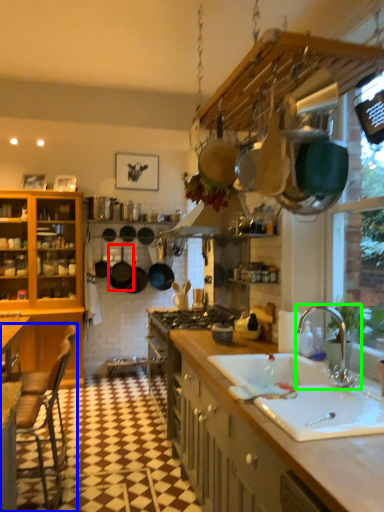
Question: Considering the real-world distances, which object is farthest from frying pan (highlighted by a red box)? chair (highlighted by a blue box) or tap (highlighted by a green box)?

Choices:
 (A) chair
 (B) tap

Answer: (B)